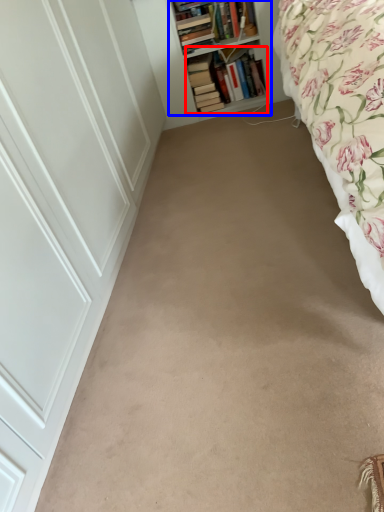
Question: Which of the following is the farthest to the observer, book (highlighted by a red box) or shelf (highlighted by a blue box)?

Choices:
 (A) book
 (B) shelf

Answer: (A)